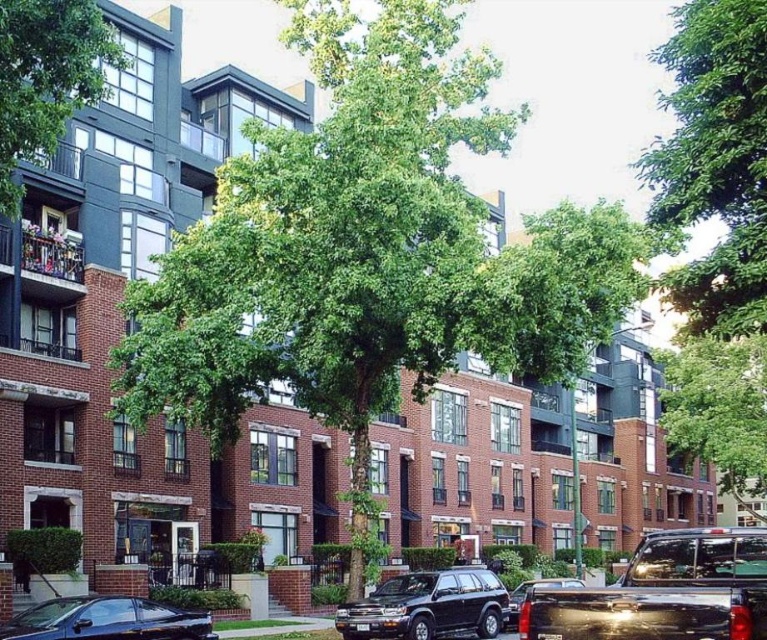
Question: Is shiny black suv at center to the right of shiny black car at lower left from the viewer's perspective?

Choices:
 (A) no
 (B) yes

Answer: (B)

Question: Which point is farther from the camera taking this photo?

Choices:
 (A) (22, 147)
 (B) (614, 627)
 (C) (680, 177)
 (D) (499, 618)

Answer: (D)

Question: Which object appears farthest from the camera in this image?

Choices:
 (A) green leafy tree at upper right
 (B) shiny black truck at center

Answer: (A)

Question: Which object is closer to the camera taking this photo?

Choices:
 (A) green leafy tree at upper left
 (B) shiny black truck at lower right
 (C) shiny black suv at center

Answer: (B)

Question: Does shiny black truck at lower right have a larger size compared to shiny black suv at center?

Choices:
 (A) no
 (B) yes

Answer: (B)

Question: Does green leafy tree at upper right have a smaller size compared to shiny black suv at center?

Choices:
 (A) no
 (B) yes

Answer: (A)